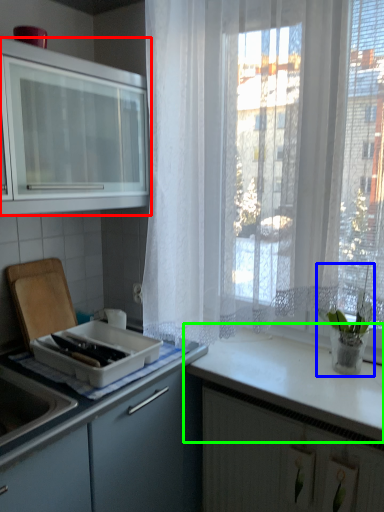
Question: Which is nearer to the cabinetry (highlighted by a red box)? houseplant (highlighted by a blue box) or countertop (highlighted by a green box).

Choices:
 (A) houseplant
 (B) countertop

Answer: (B)